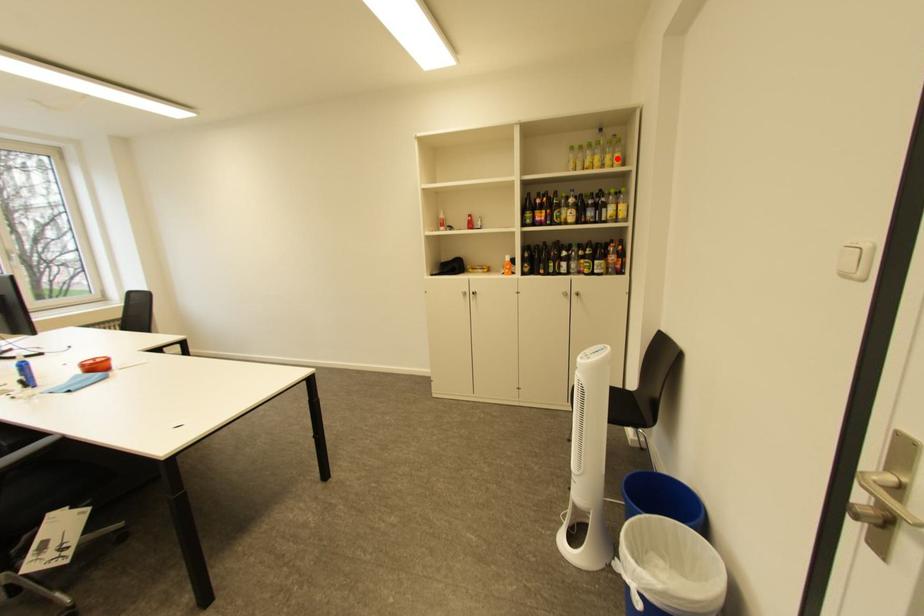
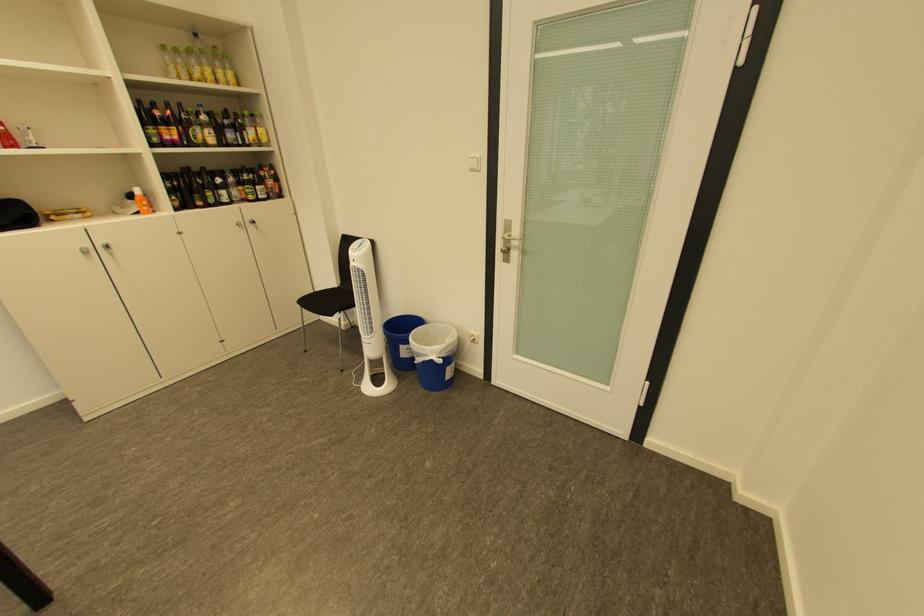
Find the pixel in the second image that matches the highlighted location in the first image.

(228, 73)